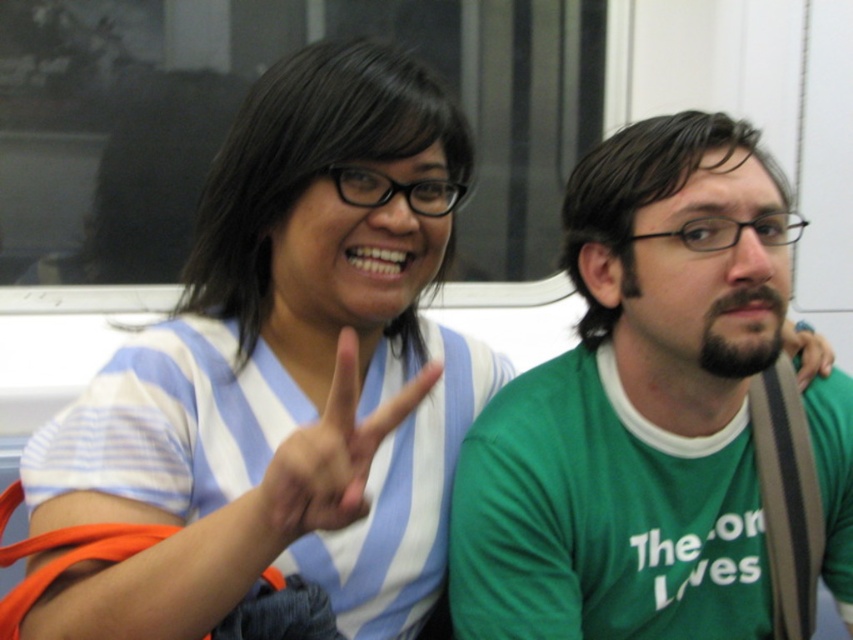
Two people are sitting next to each other on a train. The person on the left is wearing a blue striped shirt at upper left. The person on the right is wearing a green long sleeved shirt with the text The Loves. How far apart are the two people?

The blue striped shirt at upper left and the green long sleeved shirt with the text The Loves are 33.20 inches apart.

You are taking a photo of two people sitting on a train. You notice two points marked as point 1 and point 2. If point 1 is at coordinates (450, 250) and point 2 is at (625, 346), which point is closer to the camera?

Point 1 at coordinates (450, 250) is closer to the camera than point 2 at (625, 346).

You are a photographer taking a picture of the scene. You notice the blue striped shirt at upper left and the green fabric hand at right. Which object should you focus on first to ensure both are in sharp focus?

The blue striped shirt at upper left is closer to the viewer than the green fabric hand at right. To ensure both are in sharp focus, you should focus on the blue striped shirt at upper left first, as it is closer, and the depth of field will naturally include the farther object.